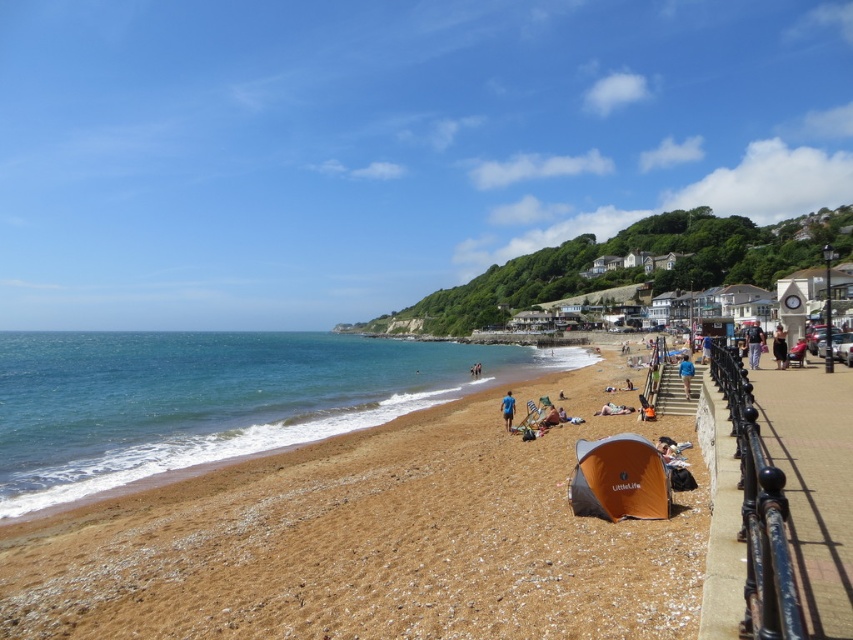
Question: Which point is farther to the camera?

Choices:
 (A) (759, 355)
 (B) (502, 410)

Answer: (B)

Question: Is blue sky at upper center behind beige fabric bag at center?

Choices:
 (A) no
 (B) yes

Answer: (B)

Question: Can you confirm if brown gravelly sand at center is positioned above beige fabric bag at center?

Choices:
 (A) yes
 (B) no

Answer: (B)

Question: Based on their relative distances, which object is farther from the blue sky at upper center?

Choices:
 (A) brown gravelly sand at center
 (B) beige fabric bag at center

Answer: (B)

Question: Which point is farther to the camera?

Choices:
 (A) brown gravelly sand at center
 (B) blue sky at upper center
 (C) dark brown fabric dress at lower right
 (D) blue fabric at center

Answer: (B)

Question: Is dark blue jeans at lower right wider than beige fabric towel at center?

Choices:
 (A) no
 (B) yes

Answer: (B)